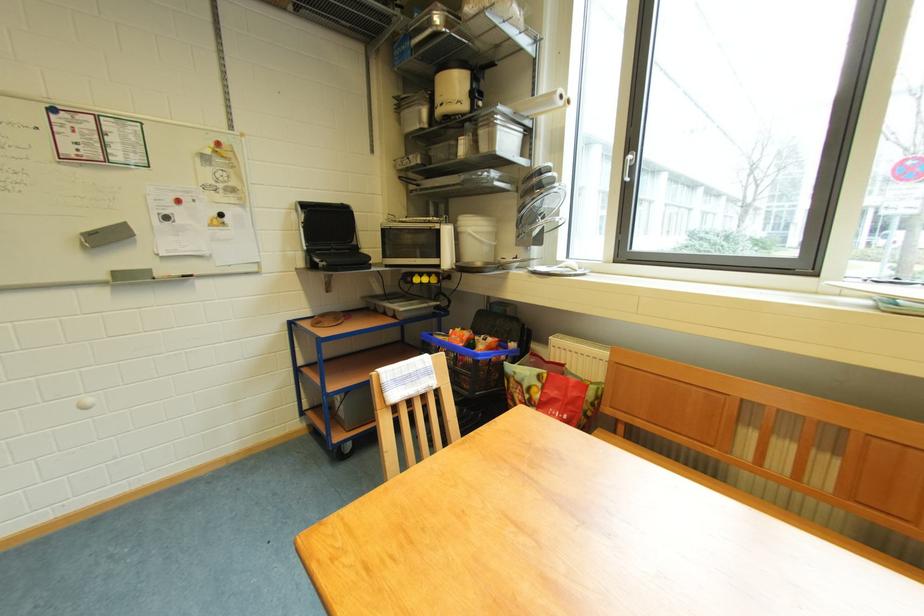
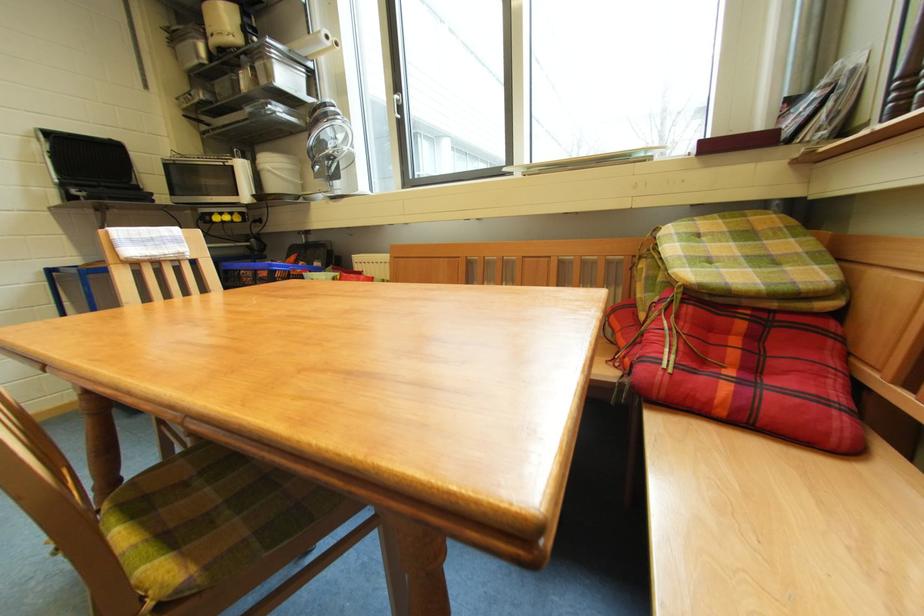
Find the pixel in the second image that matches [481,235] in the first image.

(281, 171)